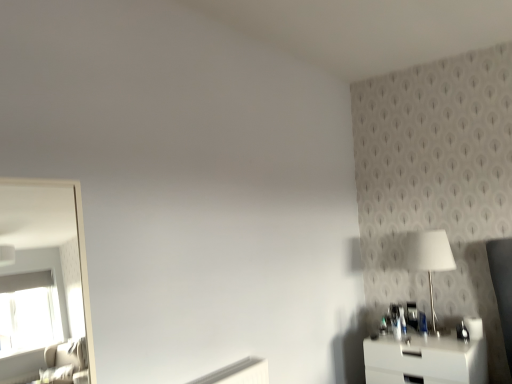
Question: Does white glossy nightstand at lower right have a lesser height compared to white glossy table lamp at right?

Choices:
 (A) no
 (B) yes

Answer: (B)

Question: Would you say white glossy nightstand at lower right is outside white glossy table lamp at right?

Choices:
 (A) yes
 (B) no

Answer: (A)

Question: Does white glossy nightstand at lower right appear on the left side of white glossy table lamp at right?

Choices:
 (A) yes
 (B) no

Answer: (A)

Question: Is white glossy nightstand at lower right thinner than white glossy table lamp at right?

Choices:
 (A) no
 (B) yes

Answer: (A)

Question: Are white glossy nightstand at lower right and white glossy table lamp at right located far from each other?

Choices:
 (A) no
 (B) yes

Answer: (A)

Question: Can you confirm if white glossy nightstand at lower right is taller than white glossy table lamp at right?

Choices:
 (A) no
 (B) yes

Answer: (A)

Question: Can white glossy nightstand at lower right be found inside white glossy table lamp at right?

Choices:
 (A) no
 (B) yes

Answer: (A)

Question: Does white glossy table lamp at right appear on the right side of white glossy nightstand at lower right?

Choices:
 (A) yes
 (B) no

Answer: (A)

Question: Is white glossy table lamp at right next to white glossy nightstand at lower right?

Choices:
 (A) no
 (B) yes

Answer: (A)

Question: Are white glossy table lamp at right and white glossy nightstand at lower right far apart?

Choices:
 (A) yes
 (B) no

Answer: (B)

Question: From a real-world perspective, is white glossy table lamp at right beneath white glossy nightstand at lower right?

Choices:
 (A) yes
 (B) no

Answer: (B)

Question: Is white glossy table lamp at right thinner than white glossy nightstand at lower right?

Choices:
 (A) yes
 (B) no

Answer: (A)

Question: In the image, is white glossy nightstand at lower right on the left side or the right side of white glossy table lamp at right?

Choices:
 (A) right
 (B) left

Answer: (B)